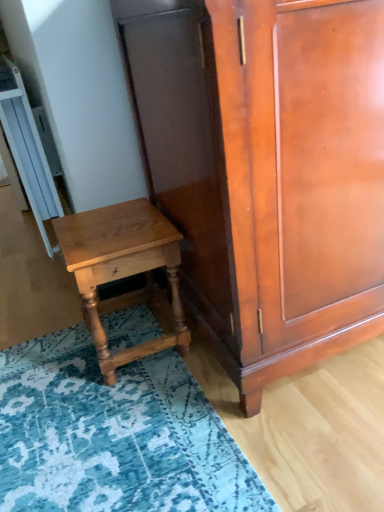
The width and height of the screenshot is (384, 512). Describe the element at coordinates (122, 270) in the screenshot. I see `light brown wood nightstand at lower left` at that location.

The height and width of the screenshot is (512, 384). Describe the element at coordinates (114, 435) in the screenshot. I see `blue textured rug at lower left` at that location.

The image size is (384, 512). I want to click on light brown wood nightstand at lower left, so click(x=122, y=270).

Considering the positions of point (107, 272) and point (142, 481), is point (107, 272) closer or farther from the camera than point (142, 481)?

Point (107, 272) appears to be farther away from the viewer than point (142, 481).

Is light brown wood nightstand at lower left in contact with blue textured rug at lower left?

light brown wood nightstand at lower left and blue textured rug at lower left are clearly separated.

Who is bigger, light brown wood nightstand at lower left or blue textured rug at lower left?

blue textured rug at lower left.

In the scene shown: Considering the relative sizes of light brown wood nightstand at lower left and blue textured rug at lower left in the image provided, is light brown wood nightstand at lower left taller than blue textured rug at lower left?

Yes.

Which of these two, shiny brown cabinet at center or light brown wood nightstand at lower left, is wider?

shiny brown cabinet at center is wider.

Image resolution: width=384 pixels, height=512 pixels. Identify the location of nightstand below the shiny brown cabinet at center (from a real-world perspective). (122, 270).

Is shiny brown cabinet at center bigger than light brown wood nightstand at lower left?

Yes, shiny brown cabinet at center is bigger than light brown wood nightstand at lower left.

From the image's perspective, which one is positioned lower, shiny brown cabinet at center or light brown wood nightstand at lower left?

light brown wood nightstand at lower left is shown below in the image.

From a real-world perspective, which is physically above, shiny brown cabinet at center or blue textured rug at lower left?

shiny brown cabinet at center, from a real-world perspective.

Is shiny brown cabinet at center inside or outside of blue textured rug at lower left?

shiny brown cabinet at center lies outside blue textured rug at lower left.

Considering the positions of objects shiny brown cabinet at center and blue textured rug at lower left in the image provided, who is more to the right, shiny brown cabinet at center or blue textured rug at lower left?

Positioned to the right is shiny brown cabinet at center.

Does light brown wood nightstand at lower left have a greater width compared to shiny brown cabinet at center?

No.

Is light brown wood nightstand at lower left shorter than shiny brown cabinet at center?

Indeed, light brown wood nightstand at lower left has a lesser height compared to shiny brown cabinet at center.

Does point (159, 237) appear closer or farther from the camera than point (278, 345)?

Point (159, 237).

Which is behind, point (174, 505) or point (332, 67)?

Point (174, 505)

Would you say blue textured rug at lower left is a long distance from shiny brown cabinet at center?

That's not correct — blue textured rug at lower left is a little close to shiny brown cabinet at center.

Based on the photo, which object is closer to the camera, blue textured rug at lower left or shiny brown cabinet at center?

shiny brown cabinet at center is more forward.

From the image's perspective, is blue textured rug at lower left located above or below shiny brown cabinet at center?

Based on their image positions, blue textured rug at lower left is located beneath shiny brown cabinet at center.

From a real-world perspective, is blue textured rug at lower left positioned above or below light brown wood nightstand at lower left?

From a real-world perspective, blue textured rug at lower left is physically below light brown wood nightstand at lower left.

Is blue textured rug at lower left positioned far away from light brown wood nightstand at lower left?

No.

Which is more to the right, blue textured rug at lower left or light brown wood nightstand at lower left?

Positioned to the right is blue textured rug at lower left.

Could you tell me if blue textured rug at lower left is turned towards light brown wood nightstand at lower left?

No, blue textured rug at lower left does not turn towards light brown wood nightstand at lower left.

You are a GUI agent. You are given a task and a screenshot of the screen. Output one action in this format:
    pyautogui.click(x=<x>, y=<y>)
    Task: Click on the nightstand behind the blue textured rug at lower left
    The height and width of the screenshot is (512, 384).
    Given the screenshot: What is the action you would take?
    pyautogui.click(x=122, y=270)

There is a light brown wood nightstand at lower left. Identify the location of cabinetry above it (from a real-world perspective). This screenshot has height=512, width=384. (266, 170).

When comparing their distances from light brown wood nightstand at lower left, does blue textured rug at lower left or shiny brown cabinet at center seem closer?

blue textured rug at lower left lies closer to light brown wood nightstand at lower left than the other object.

Which object lies further to the anchor point light brown wood nightstand at lower left, shiny brown cabinet at center or blue textured rug at lower left?

Based on the image, shiny brown cabinet at center appears to be further to light brown wood nightstand at lower left.

Considering their positions, is blue textured rug at lower left positioned further to shiny brown cabinet at center than light brown wood nightstand at lower left?

blue textured rug at lower left.

Which object lies nearer to the anchor point shiny brown cabinet at center, light brown wood nightstand at lower left or blue textured rug at lower left?

light brown wood nightstand at lower left.

Estimate the real-world distances between objects in this image. Which object is closer to blue textured rug at lower left, light brown wood nightstand at lower left or shiny brown cabinet at center?

light brown wood nightstand at lower left is closer to blue textured rug at lower left.

Considering their positions, is shiny brown cabinet at center positioned further to blue textured rug at lower left than light brown wood nightstand at lower left?

shiny brown cabinet at center.

At what (x,y) coordinates should I click in order to perform the action: click on nightstand between shiny brown cabinet at center and blue textured rug at lower left from top to bottom. Please return your answer as a coordinate pair (x, y). Looking at the image, I should click on (122, 270).